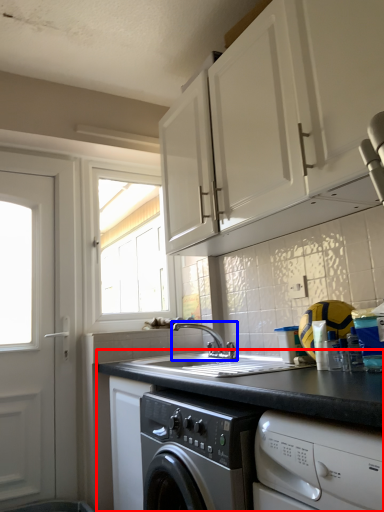
Question: Which point is closer to the camera, countertop (highlighted by a red box) or tap (highlighted by a blue box)?

Choices:
 (A) countertop
 (B) tap

Answer: (A)